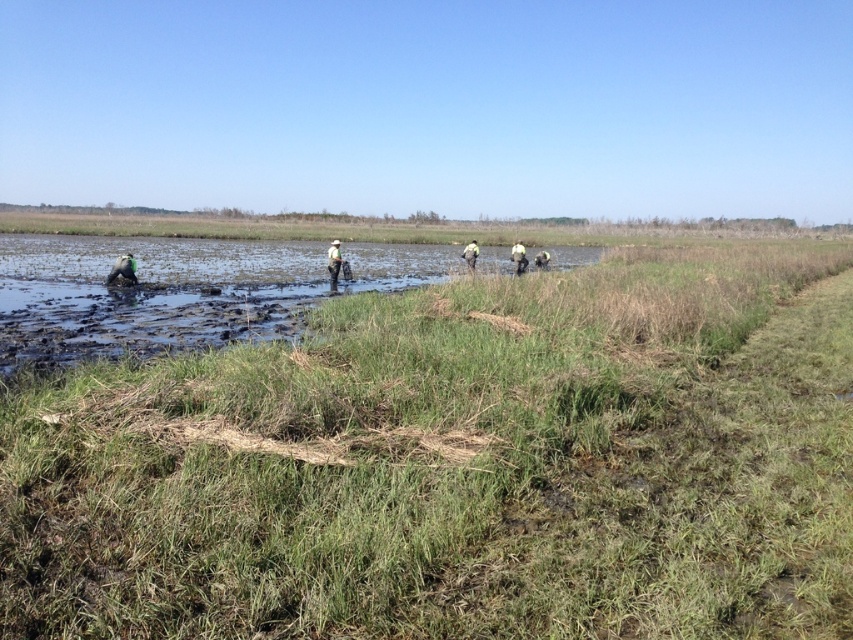
Question: Which point is farther from the camera taking this photo?

Choices:
 (A) (534, 404)
 (B) (463, 256)
 (C) (537, 259)
 (D) (524, 259)

Answer: (C)

Question: Does dark green fabric at lower left lie behind yellow fabric person at center?

Choices:
 (A) yes
 (B) no

Answer: (B)

Question: Can you confirm if dark green fabric at lower left is positioned to the left of yellow reflective vest at center?

Choices:
 (A) no
 (B) yes

Answer: (B)

Question: Is the position of white matte hat at center less distant than that of green fabric jacket at center?

Choices:
 (A) no
 (B) yes

Answer: (B)

Question: Which object appears closest to the camera in this image?

Choices:
 (A) green grass at center
 (B) white matte hat at center
 (C) yellow reflective vest at center
 (D) green fabric jacket at center

Answer: (A)

Question: Which of these objects is positioned closest to the white matte hat at center?

Choices:
 (A) yellow fabric person at center
 (B) yellow reflective vest at center
 (C) green fabric jacket at center

Answer: (C)